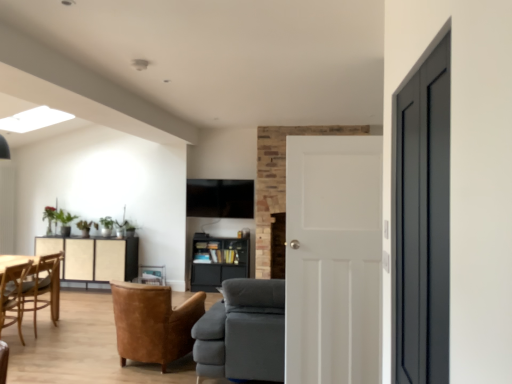
This screenshot has width=512, height=384. Describe the element at coordinates (333, 259) in the screenshot. I see `white matte door at center, acting as the 1th door starting from the back` at that location.

You are a GUI agent. You are given a task and a screenshot of the screen. Output one action in this format:
    pyautogui.click(x=<x>, y=<y>)
    Task: Click on the matte black door at right, the second door from the back
    The height and width of the screenshot is (384, 512).
    Given the screenshot: What is the action you would take?
    pyautogui.click(x=423, y=222)

What do you see at coordinates (423, 222) in the screenshot? I see `matte black door at right, which ranks as the 1th door in front-to-back order` at bounding box center [423, 222].

Locate an element on the screen. This screenshot has width=512, height=384. matte black bookshelf at center is located at coordinates (218, 261).

Measure the distance between point (232, 312) and camera.

Point (232, 312) is 3.48 meters from camera.

This screenshot has width=512, height=384. What do you see at coordinates (42, 287) in the screenshot?
I see `wooden chair at lower left, acting as the 1th chair starting from the left` at bounding box center [42, 287].

Measure the distance between point (16, 260) and camera.

4.22 meters.

In order to click on matte beige cabinet at center left in this screenshot , I will do `click(93, 258)`.

Consider the image. Does matte beige cabinet at center left have a lesser width compared to matte black bookshelf at center?

Incorrect, the width of matte beige cabinet at center left is not less than that of matte black bookshelf at center.

Can we say matte beige cabinet at center left lies outside matte black bookshelf at center?

matte beige cabinet at center left is positioned outside matte black bookshelf at center.

Is matte beige cabinet at center left shorter than matte black bookshelf at center?

No, matte beige cabinet at center left is not shorter than matte black bookshelf at center.

Does matte beige cabinet at center left turn towards matte black bookshelf at center?

No, matte beige cabinet at center left does not turn towards matte black bookshelf at center.

Is gray fabric couch at center surrounded by leather armchair at center, the second chair in the back-to-front sequence?

No, gray fabric couch at center is not inside leather armchair at center, the second chair in the back-to-front sequence.

Does leather armchair at center, the first chair positioned from the right, have a greater height compared to gray fabric couch at center?

No.

Could you tell me if leather armchair at center, the first chair positioned from the right, is facing gray fabric couch at center?

No.

Measure the distance from white matte door at center, acting as the 1th door starting from the back, to leather armchair at center, placed as the second chair when sorted from left to right.

4.61 feet.

Which point is more distant from viewer, (354, 328) or (147, 287)?

The point (147, 287) is farther from the camera.

From the picture: Is white matte door at center, the 2th door positioned from the front, completely or partially outside of leather armchair at center, the first chair positioned from the right?

Yes, white matte door at center, the 2th door positioned from the front, is outside of leather armchair at center, the first chair positioned from the right.

Are white matte door at center, the 2th door positioned from the front, and leather armchair at center, the first chair viewed from the front, far apart?

Yes, white matte door at center, the 2th door positioned from the front, is far from leather armchair at center, the first chair viewed from the front.

From the image's perspective, between white matte door at center, acting as the 1th door starting from the back, and wooden chair at lower left, arranged as the second chair when viewed from the right, which one is located above?

white matte door at center, acting as the 1th door starting from the back, appears higher in the image.

Does white matte door at center, the 2th door positioned from the front, have a smaller size compared to wooden chair at lower left, acting as the 1th chair starting from the left?

Yes, white matte door at center, the 2th door positioned from the front, is smaller than wooden chair at lower left, acting as the 1th chair starting from the left.

From the picture: Is white matte door at center, the 2th door positioned from the front, behind wooden chair at lower left, the 2th chair viewed from the front?

No, it is in front of wooden chair at lower left, the 2th chair viewed from the front.

From the image's perspective, which object appears higher, matte black door at right, the second door from the back, or wooden chair at lower left, acting as the 1th chair starting from the left?

matte black door at right, the second door from the back, is shown above in the image.

From a real-world perspective, is matte black door at right, which ranks as the 1th door in front-to-back order, physically above wooden chair at lower left, arranged as the second chair when viewed from the right?

Yes, from a real-world perspective, matte black door at right, which ranks as the 1th door in front-to-back order, is over wooden chair at lower left, arranged as the second chair when viewed from the right

Does matte black door at right, which ranks as the 1th door in front-to-back order, have a lesser width compared to wooden chair at lower left, the 2th chair viewed from the front?

Correct, the width of matte black door at right, which ranks as the 1th door in front-to-back order, is less than that of wooden chair at lower left, the 2th chair viewed from the front.

Which of these two, matte black door at right, which ranks as the 1th door in front-to-back order, or wooden chair at lower left, the 2th chair viewed from the front, is smaller?

matte black door at right, which ranks as the 1th door in front-to-back order.

From a real-world perspective, which is physically above, matte black bookshelf at center or matte black door at right, which ranks as the 1th door in front-to-back order?

In real-world perspective, matte black door at right, which ranks as the 1th door in front-to-back order, is above.

Could you tell me if matte black bookshelf at center is facing matte black door at right, which ranks as the 1th door in front-to-back order?

Yes, matte black bookshelf at center is oriented towards matte black door at right, which ranks as the 1th door in front-to-back order.

Find the location of a particular element. Image resolution: width=512 pixels, height=384 pixels. shelf that is below the matte black door at right, the second door from the back (from the image's perspective) is located at coordinates (218, 261).

Is matte black bookshelf at center not close to matte black door at right, the second door from the back?

Yes.

From a real-world perspective, is wooden chair at lower left, arranged as the second chair when viewed from the right, beneath white matte door at center, the 2th door positioned from the front?

Yes.

Is wooden chair at lower left, which is the 1th chair in back-to-front order, situated inside white matte door at center, acting as the 1th door starting from the back, or outside?

The correct answer is: outside.

From the image's perspective, is wooden chair at lower left, the 2th chair viewed from the front, on top of white matte door at center, acting as the 1th door starting from the back?

No, from the image's perspective, wooden chair at lower left, the 2th chair viewed from the front, is not above white matte door at center, acting as the 1th door starting from the back.

Are wooden chair at lower left, which is the 1th chair in back-to-front order, and white matte door at center, acting as the 1th door starting from the back, making contact?

No, wooden chair at lower left, which is the 1th chair in back-to-front order, is not with white matte door at center, acting as the 1th door starting from the back.

Locate an element on the screen. cabinetry in front of the matte black bookshelf at center is located at coordinates (x=93, y=258).

This screenshot has height=384, width=512. Identify the location of studio couch above the leather armchair at center, placed as the second chair when sorted from left to right (from a real-world perspective). (243, 332).

When comparing their distances from gray fabric couch at center, does white matte door at center, acting as the 1th door starting from the back, or matte beige cabinet at center left seem further?

Based on the image, matte beige cabinet at center left appears to be further to gray fabric couch at center.

Considering their positions, is leather armchair at center, the second chair in the back-to-front sequence, positioned closer to matte black door at right, which ranks as the 1th door in front-to-back order, than wooden chair at lower left, arranged as the second chair when viewed from the right?

Based on the image, leather armchair at center, the second chair in the back-to-front sequence, appears to be nearer to matte black door at right, which ranks as the 1th door in front-to-back order.

Based on their spatial positions, is matte beige cabinet at center left or matte black bookshelf at center further from leather armchair at center, the first chair positioned from the right?

matte black bookshelf at center lies further to leather armchair at center, the first chair positioned from the right, than the other object.

Estimate the real-world distances between objects in this image. Which object is closer to wooden chair at lower left, which is the 1th chair in back-to-front order, matte black door at right, the second door from the back, or matte black bookshelf at center?

matte black bookshelf at center is positioned closer to the anchor wooden chair at lower left, which is the 1th chair in back-to-front order.

Considering their positions, is gray fabric couch at center positioned further to matte black door at right, the second door from the back, than leather armchair at center, the first chair positioned from the right?

leather armchair at center, the first chair positioned from the right, is further to matte black door at right, the second door from the back.

Which object lies nearer to the anchor point matte black bookshelf at center, gray fabric couch at center or wooden chair at lower left, the 2th chair viewed from the front?

wooden chair at lower left, the 2th chair viewed from the front.

Considering their positions, is gray fabric couch at center positioned closer to matte beige cabinet at center left than leather armchair at center, the first chair viewed from the front?

Based on the image, leather armchair at center, the first chair viewed from the front, appears to be nearer to matte beige cabinet at center left.

From the image, which object appears to be nearer to matte black bookshelf at center, leather armchair at center, the first chair positioned from the right, or white matte door at center, acting as the 1th door starting from the back?

leather armchair at center, the first chair positioned from the right, is positioned closer to the anchor matte black bookshelf at center.

Locate an element on the screen. This screenshot has height=384, width=512. door between matte black door at right, the second door from the back, and matte black bookshelf at center in the front-back direction is located at coordinates (333, 259).

The width and height of the screenshot is (512, 384). Identify the location of studio couch between white matte door at center, the 2th door positioned from the front, and matte beige cabinet at center left from front to back. click(243, 332).

You are a GUI agent. You are given a task and a screenshot of the screen. Output one action in this format:
    pyautogui.click(x=<x>, y=<y>)
    Task: Click on the chair between wooden chair at lower left, arranged as the second chair when viewed from the right, and white matte door at center, the 2th door positioned from the front, in the horizontal direction
    The image size is (512, 384).
    Given the screenshot: What is the action you would take?
    pyautogui.click(x=153, y=323)

You are a GUI agent. You are given a task and a screenshot of the screen. Output one action in this format:
    pyautogui.click(x=<x>, y=<y>)
    Task: Click on the studio couch between matte black door at right, which ranks as the 1th door in front-to-back order, and matte beige cabinet at center left in the front-back direction
    The image size is (512, 384).
    Given the screenshot: What is the action you would take?
    pyautogui.click(x=243, y=332)